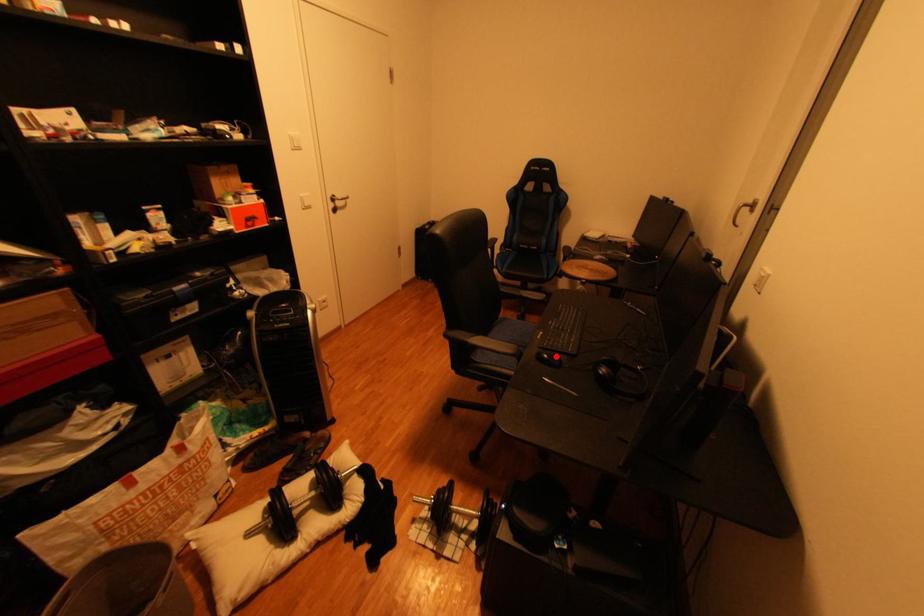
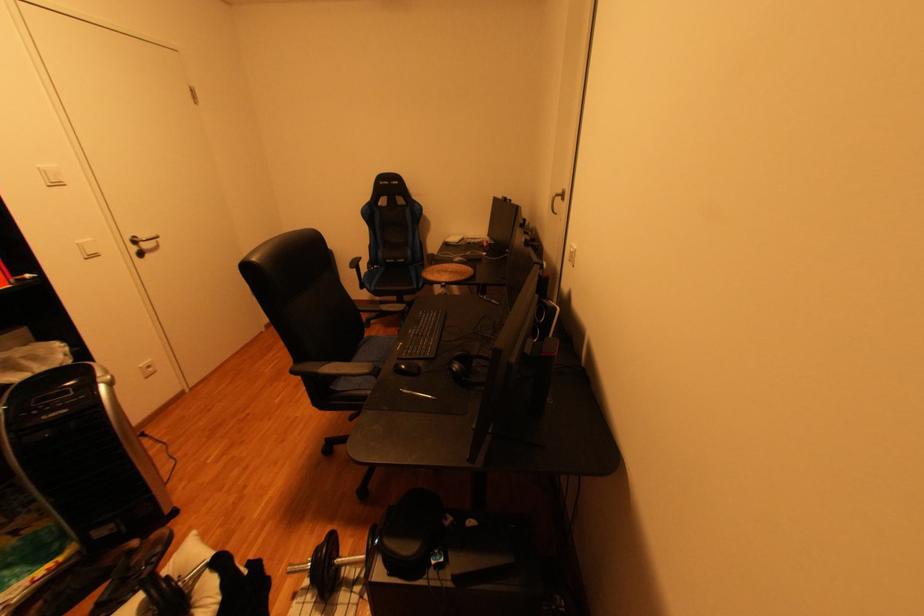
Where in the second image is the point corresponding to the highlighted location from the first image?

(411, 367)